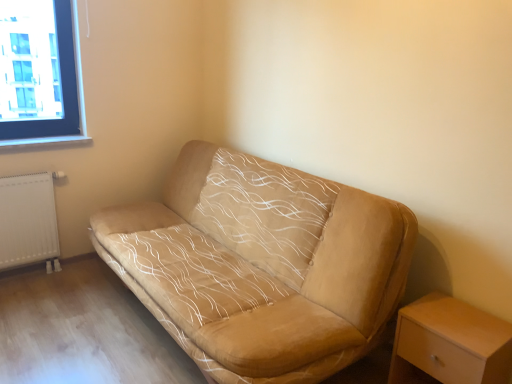
I want to click on suede beige couch at center, so click(263, 265).

What do you see at coordinates (28, 221) in the screenshot? Image resolution: width=512 pixels, height=384 pixels. I see `white matte radiator at lower left` at bounding box center [28, 221].

Identify the location of suede beige couch at center. The height and width of the screenshot is (384, 512). (263, 265).

How far apart are white matte radiator at lower left and light wood/wooden nightstand at lower right?

The distance of white matte radiator at lower left from light wood/wooden nightstand at lower right is 8.06 feet.

Considering the points (0, 215) and (431, 334), which point is behind, point (0, 215) or point (431, 334)?

The point (0, 215) is more distant.

What's the angular difference between white matte radiator at lower left and light wood/wooden nightstand at lower right's facing directions?

There is a 89.9-degree angle between the facing directions of white matte radiator at lower left and light wood/wooden nightstand at lower right.

In terms of height, does white matte radiator at lower left look taller or shorter compared to light wood/wooden nightstand at lower right?

Clearly, white matte radiator at lower left is taller compared to light wood/wooden nightstand at lower right.

Considering the sizes of objects white matte radiator at lower left and suede beige couch at center in the image provided, who is taller, white matte radiator at lower left or suede beige couch at center?

Standing taller between the two is suede beige couch at center.

Could you tell me if white matte radiator at lower left is turned towards suede beige couch at center?

No, white matte radiator at lower left is not turned towards suede beige couch at center.

Are white matte radiator at lower left and suede beige couch at center making contact?

white matte radiator at lower left is not next to suede beige couch at center, and they're not touching.

From the picture: From the image's perspective, which one is positioned higher, white matte radiator at lower left or suede beige couch at center?

white matte radiator at lower left is shown above in the image.

Is suede beige couch at center oriented towards white matte radiator at lower left?

No, suede beige couch at center is not oriented towards white matte radiator at lower left.

From their relative heights in the image, would you say suede beige couch at center is taller or shorter than white matte radiator at lower left?

Clearly, suede beige couch at center is taller compared to white matte radiator at lower left.

Does suede beige couch at center touch white matte radiator at lower left?

No, suede beige couch at center is not touching white matte radiator at lower left.

Which object is further away from the camera, suede beige couch at center or white matte radiator at lower left?

white matte radiator at lower left is further away from the camera.

In the image, is light wood/wooden nightstand at lower right on the left side or the right side of suede beige couch at center?

From the image, it's evident that light wood/wooden nightstand at lower right is to the right of suede beige couch at center.

Is point (409, 328) positioned after point (206, 269)?

No, (409, 328) is in front of (206, 269).

Are light wood/wooden nightstand at lower right and suede beige couch at center making contact?

No, light wood/wooden nightstand at lower right is not making contact with suede beige couch at center.

Consider the image. Could you tell me if light wood/wooden nightstand at lower right is turned towards suede beige couch at center?

No, light wood/wooden nightstand at lower right is not turned towards suede beige couch at center.

Considering the positions of objects light wood/wooden nightstand at lower right and white matte radiator at lower left in the image provided, who is behind, light wood/wooden nightstand at lower right or white matte radiator at lower left?

white matte radiator at lower left is behind.

Is light wood/wooden nightstand at lower right wider than white matte radiator at lower left?

Indeed, light wood/wooden nightstand at lower right has a greater width compared to white matte radiator at lower left.

Does point (496, 355) appear closer or farther from the camera than point (15, 244)?

Clearly, point (496, 355) is closer to the camera than point (15, 244).

Find the location of a particular element. The height and width of the screenshot is (384, 512). radiator behind the light wood/wooden nightstand at lower right is located at coordinates (28, 221).

From a real-world perspective, is suede beige couch at center under light wood/wooden nightstand at lower right?

No, from a real-world perspective, suede beige couch at center is not under light wood/wooden nightstand at lower right.

Considering the sizes of objects suede beige couch at center and light wood/wooden nightstand at lower right in the image provided, who is taller, suede beige couch at center or light wood/wooden nightstand at lower right?

With more height is suede beige couch at center.

The image size is (512, 384). In order to click on nightstand behind the suede beige couch at center in this screenshot , I will do (451, 343).

Locate an element on the screen. The width and height of the screenshot is (512, 384). nightstand below the white matte radiator at lower left (from a real-world perspective) is located at coordinates (451, 343).

The width and height of the screenshot is (512, 384). Identify the location of studio couch on the right of white matte radiator at lower left. (263, 265).

Considering their positions, is suede beige couch at center positioned closer to light wood/wooden nightstand at lower right than white matte radiator at lower left?

suede beige couch at center is closer to light wood/wooden nightstand at lower right.

From the image, which object appears to be farther from suede beige couch at center, white matte radiator at lower left or light wood/wooden nightstand at lower right?

The object further to suede beige couch at center is white matte radiator at lower left.

When comparing their distances from light wood/wooden nightstand at lower right, does white matte radiator at lower left or suede beige couch at center seem closer?

suede beige couch at center is positioned closer to the anchor light wood/wooden nightstand at lower right.

Looking at the image, which one is located closer to suede beige couch at center, light wood/wooden nightstand at lower right or white matte radiator at lower left?

The object closer to suede beige couch at center is light wood/wooden nightstand at lower right.

In the scene shown: Considering their positions, is suede beige couch at center positioned closer to white matte radiator at lower left than light wood/wooden nightstand at lower right?

suede beige couch at center is closer to white matte radiator at lower left.

From the image, which object appears to be farther from white matte radiator at lower left, light wood/wooden nightstand at lower right or suede beige couch at center?

light wood/wooden nightstand at lower right.

Where is `studio couch between white matte radiator at lower left and light wood/wooden nightstand at lower right`? The image size is (512, 384). studio couch between white matte radiator at lower left and light wood/wooden nightstand at lower right is located at coordinates (263, 265).